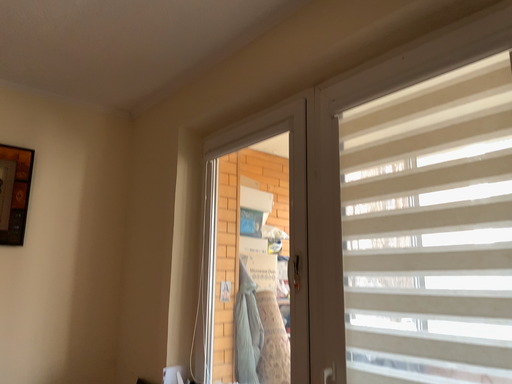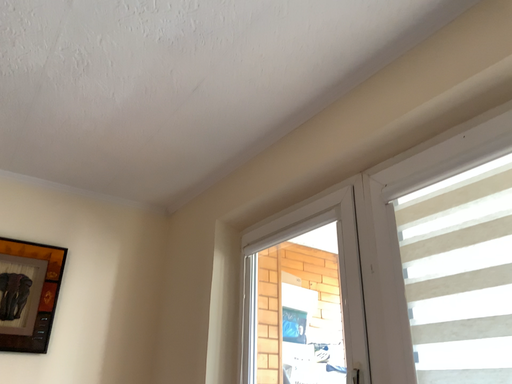
Question: How did the camera likely rotate when shooting the video?

Choices:
 (A) rotated upward
 (B) rotated downward

Answer: (A)